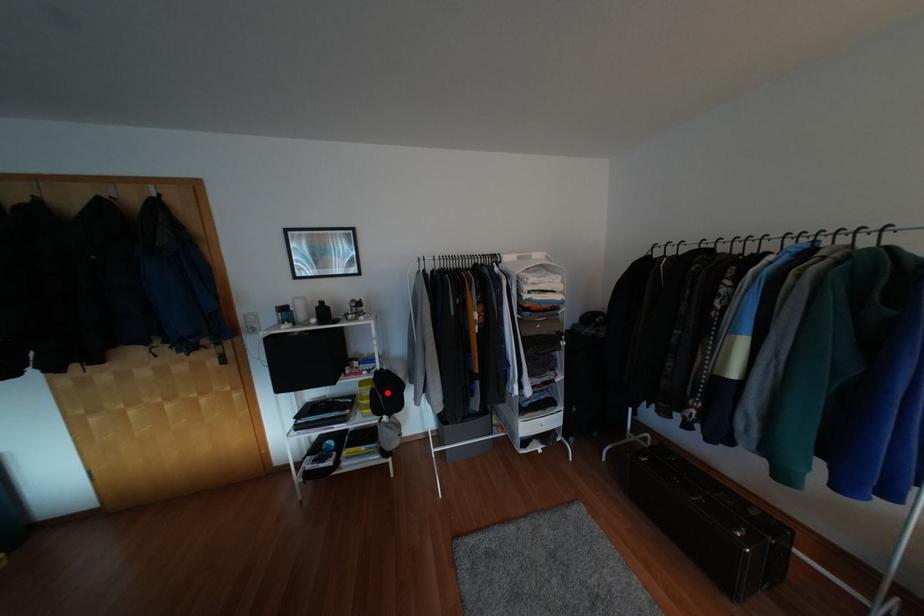
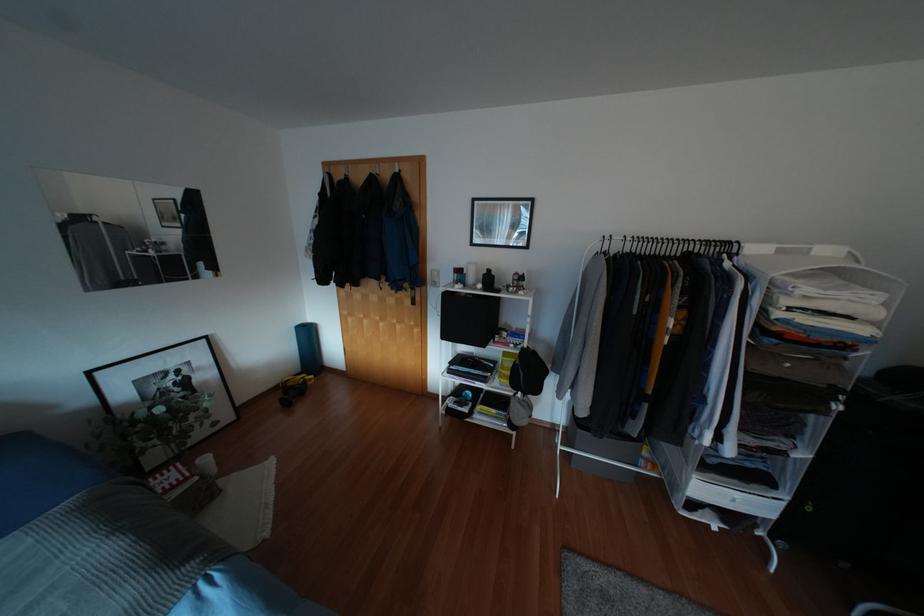
Locate, in the second image, the point that corresponds to the highlighted location in the first image.

(528, 371)